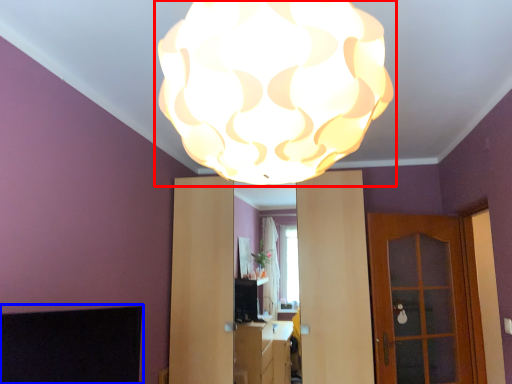
Question: Which object is further to the camera taking this photo, lamp (highlighted by a red box) or fireplace (highlighted by a blue box)?

Choices:
 (A) lamp
 (B) fireplace

Answer: (B)